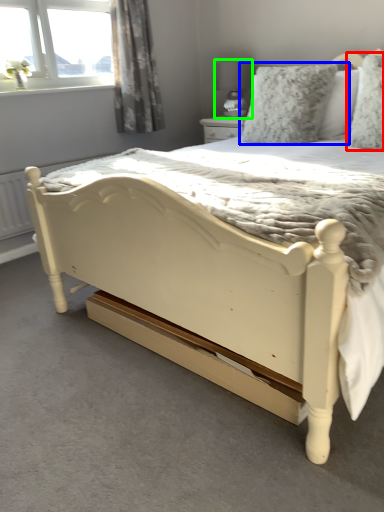
Question: Based on their relative distances, which object is nearer to pillow (highlighted by a red box)? Choose from pillow (highlighted by a blue box) and lamp (highlighted by a green box).

Choices:
 (A) pillow
 (B) lamp

Answer: (A)